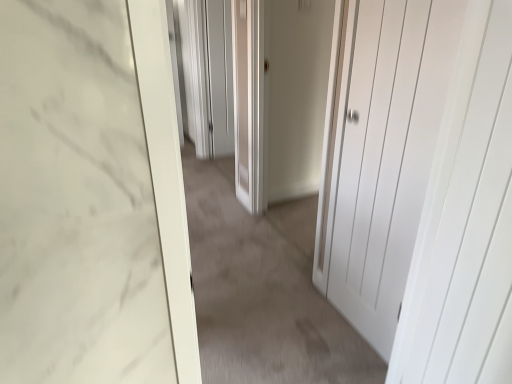
Question: From the image's perspective, relative to white matte door at center, is matte gray screen door at center above or below?

Choices:
 (A) above
 (B) below

Answer: (A)

Question: Is matte gray screen door at center wider or thinner than white matte door at center?

Choices:
 (A) thin
 (B) wide

Answer: (A)

Question: Which is farther from the matte gray screen door at center?

Choices:
 (A) white matte door at center, arranged as the 1th door when viewed from the right
 (B) white matte door at center
 (C) white matte door at center, the second door positioned from the right

Answer: (A)

Question: Considering the real-world distances, which object is farthest from the matte gray screen door at center?

Choices:
 (A) white matte door at center
 (B) white matte door at center, which appears as the first door when viewed from the left
 (C) white matte door at center, arranged as the 1th door when viewed from the right

Answer: (C)